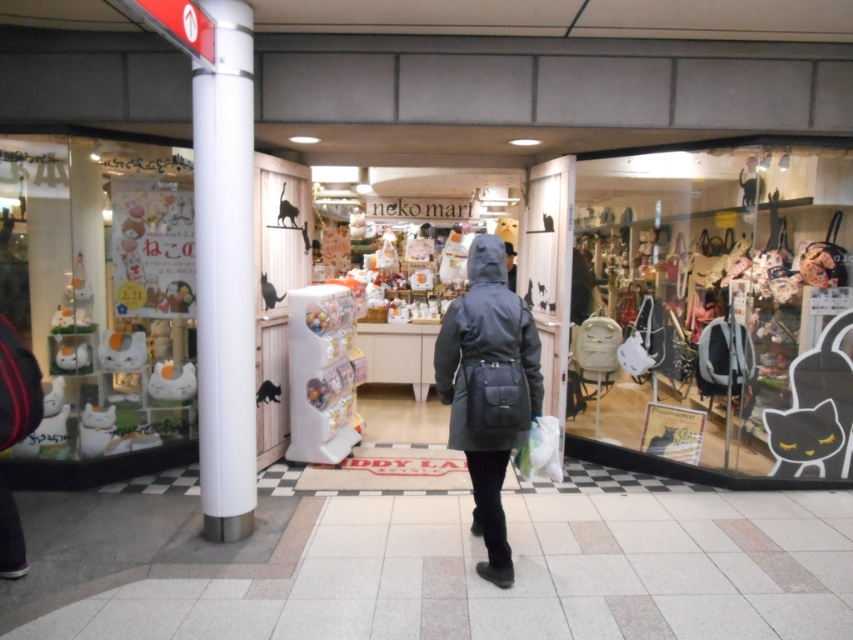
Question: Considering the relative positions of white smooth pole at left and dark gray hooded coat at center in the image provided, where is white smooth pole at left located with respect to dark gray hooded coat at center?

Choices:
 (A) left
 (B) right

Answer: (A)

Question: Which of the following is the closest to the observer?

Choices:
 (A) (463, 310)
 (B) (234, 538)

Answer: (A)

Question: Which of the following is the farthest from the observer?

Choices:
 (A) (508, 378)
 (B) (229, 371)

Answer: (B)

Question: Among these objects, which one is farthest from the camera?

Choices:
 (A) white smooth pole at left
 (B) dark gray hooded coat at center

Answer: (A)

Question: Is white smooth pole at left thinner than dark gray hooded coat at center?

Choices:
 (A) yes
 (B) no

Answer: (A)

Question: Is white smooth pole at left thinner than dark gray hooded coat at center?

Choices:
 (A) yes
 (B) no

Answer: (A)